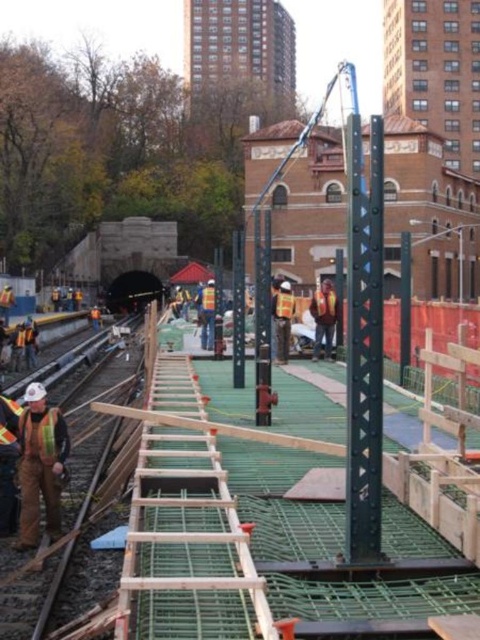
You are a safety inspector at the construction site and need to ensure that all safety gear is appropriately sized for workers. You notice two reflective safety vests in the scene. Which one, the reflective safety vest at left or the reflective orange safety vest at lower left, is larger in size?

The reflective safety vest at left is bigger than the reflective orange safety vest at lower left, so the larger one is the reflective safety vest at left.

You are a construction worker standing at the entrance of the construction site. You need to locate the green wooden scaffolding at center. According to the coordinates provided, where exactly is it positioned?

The green wooden scaffolding at center is positioned at the 2D coordinates point (208, 518).

Based on the photo, you are a construction worker on the site and need to determine which object takes up more space. Which one is larger between the green wooden scaffolding at center and the reflective orange safety vest at lower left?

The green wooden scaffolding at center is bigger than the reflective orange safety vest at lower left according to the description.